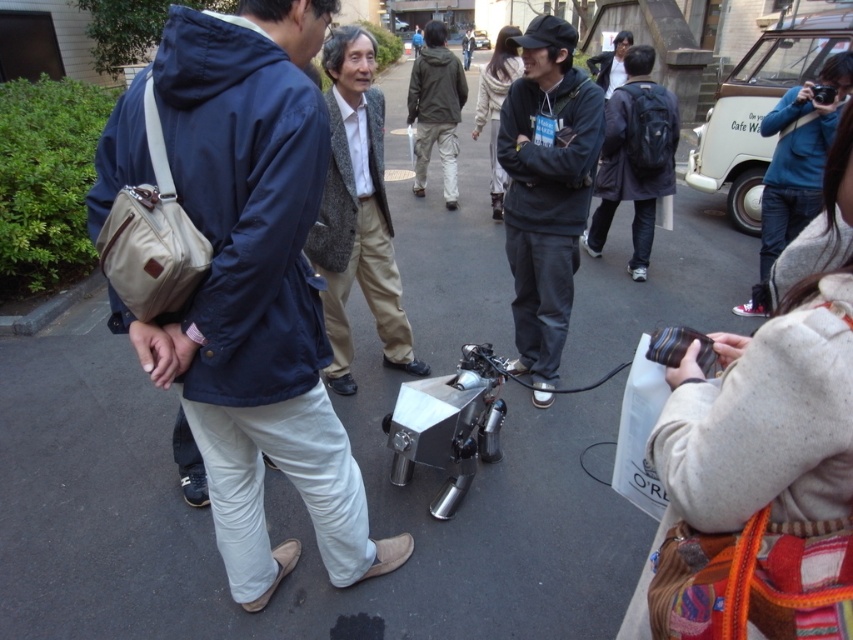
Measure the distance from dark gray hoodie at center to blue denim jacket at upper right.

They are 6.53 feet apart.

Who is higher up, dark gray hoodie at center or blue denim jacket at upper right?

blue denim jacket at upper right

What do you see at coordinates (546, 192) in the screenshot? I see `dark gray hoodie at center` at bounding box center [546, 192].

Find the location of a particular element. Image resolution: width=853 pixels, height=640 pixels. dark gray hoodie at center is located at coordinates (546, 192).

Who is shorter, matte blue jacket at center or dark gray hoodie at center?

With less height is matte blue jacket at center.

Is matte blue jacket at center positioned before dark gray hoodie at center?

Yes, it is in front of dark gray hoodie at center.

Find the location of a particular element. This screenshot has width=853, height=640. matte blue jacket at center is located at coordinates (247, 282).

Who is lower down, matte blue jacket at center or black plastic camera at upper right?

matte blue jacket at center

Is the position of matte blue jacket at center less distant than that of black plastic camera at upper right?

Yes, it is in front of black plastic camera at upper right.

The width and height of the screenshot is (853, 640). Find the location of `matte blue jacket at center`. matte blue jacket at center is located at coordinates (247, 282).